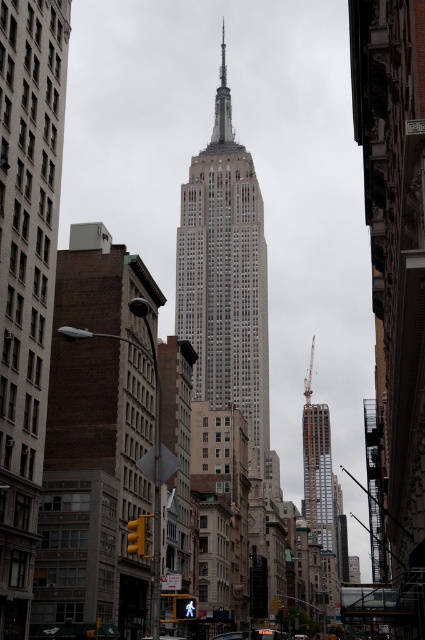
You are standing on the sidewalk in front of the Empire State Building and notice two points marked on the ground. One is at point (237, 212) and the other at point (266, 628). If you want to walk towards the Empire State Building, which point will you pass first?

You will pass point (266, 628) first because it is closer to you than point (237, 212), which is further behind.

You are standing on the street looking at the Empire State Building. There are two points marked on the buildings in the scene. The first point is at coordinates point (254, 445) and the second is at point (229, 104). Which of these two points is closer to you?

Point (254, 445) is closer to the viewer than point (229, 104) according to the description.

You are a city planner evaluating the urban layout. Considering the Empire State Building as a reference point, which object among the white glass building at center and the metallic silver car at center has a greater height?

The white glass building at center is taller than the metallic silver car at center.